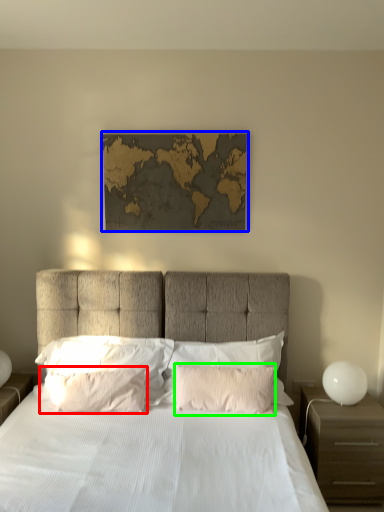
Question: Which is farther away from pillow (highlighted by a red box)? picture frame (highlighted by a blue box) or pillow (highlighted by a green box)?

Choices:
 (A) picture frame
 (B) pillow

Answer: (A)